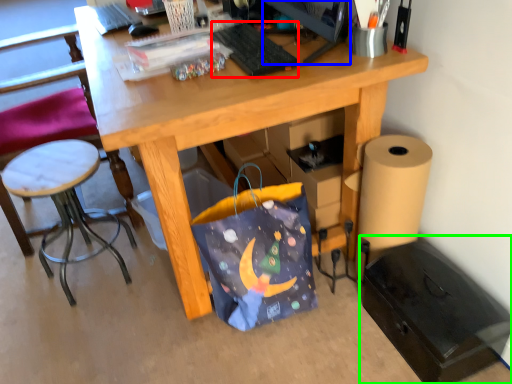
Question: Based on their relative distances, which object is nearer to keyboard (highlighted by a red box)? Choose from computer monitor (highlighted by a blue box) and file cabinet (highlighted by a green box).

Choices:
 (A) computer monitor
 (B) file cabinet

Answer: (A)